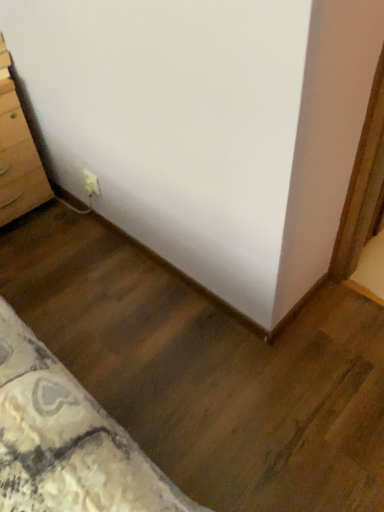
Question: Is light brown wooden chest of drawers at left inside the boundaries of white plastic outlet at lower left, or outside?

Choices:
 (A) inside
 (B) outside

Answer: (B)

Question: Based on their positions, is light brown wooden chest of drawers at left located to the left or right of white plastic outlet at lower left?

Choices:
 (A) right
 (B) left

Answer: (B)

Question: From the image's perspective, is light brown wooden chest of drawers at left located above or below white plastic outlet at lower left?

Choices:
 (A) above
 (B) below

Answer: (A)

Question: Considering the positions of point (94, 182) and point (19, 163), is point (94, 182) closer or farther from the camera than point (19, 163)?

Choices:
 (A) farther
 (B) closer

Answer: (B)

Question: Is white plastic outlet at lower left to the left or to the right of light brown wooden chest of drawers at left in the image?

Choices:
 (A) left
 (B) right

Answer: (B)

Question: From the image's perspective, is white plastic outlet at lower left positioned above or below light brown wooden chest of drawers at left?

Choices:
 (A) above
 (B) below

Answer: (B)

Question: In terms of width, does white plastic outlet at lower left look wider or thinner when compared to light brown wooden chest of drawers at left?

Choices:
 (A) wide
 (B) thin

Answer: (B)